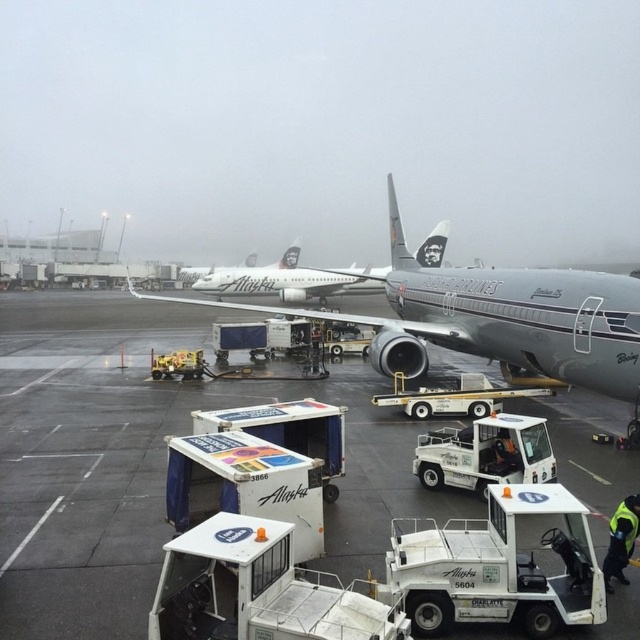
Does silver metallic airplane at center have a greater height compared to white glossy airplane at center?

Yes.

Is silver metallic airplane at center above white glossy airplane at center?

Yes.

Between point (410, 301) and point (180, 276), which one is positioned in front?

Point (410, 301) is more forward.

Find the location of a particular element. This screenshot has width=640, height=640. silver metallic airplane at center is located at coordinates (497, 317).

Is smooth gray tarmac at center smaller than silver metallic airplane at center?

Yes.

This screenshot has width=640, height=640. In order to click on smooth gray tarmac at center in this screenshot , I will do [x=150, y=460].

Locate an element on the screen. The height and width of the screenshot is (640, 640). smooth gray tarmac at center is located at coordinates (150, 460).

Who is positioned more to the right, smooth gray tarmac at center or white glossy airplane at center?

From the viewer's perspective, smooth gray tarmac at center appears more on the right side.

Identify the location of smooth gray tarmac at center. This screenshot has height=640, width=640. coord(150,460).